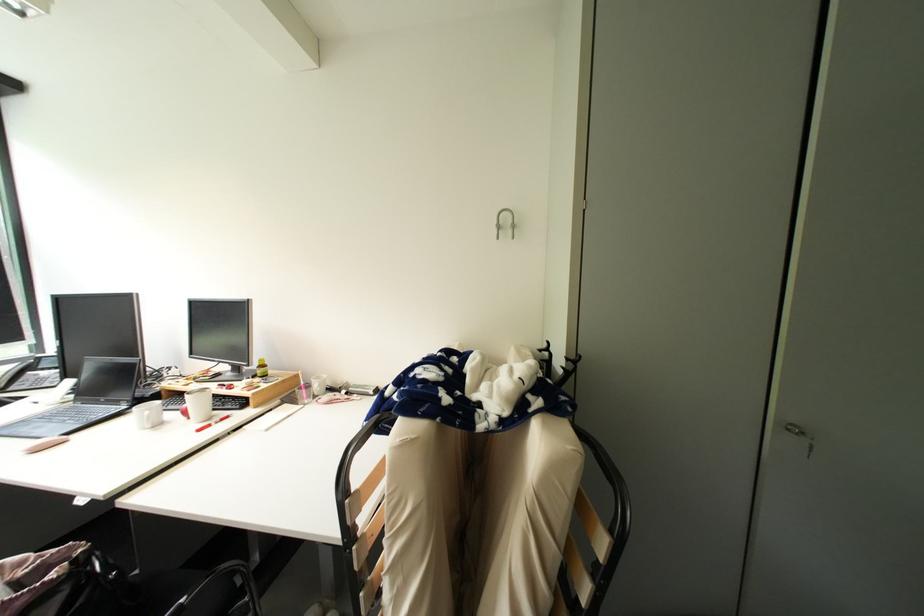
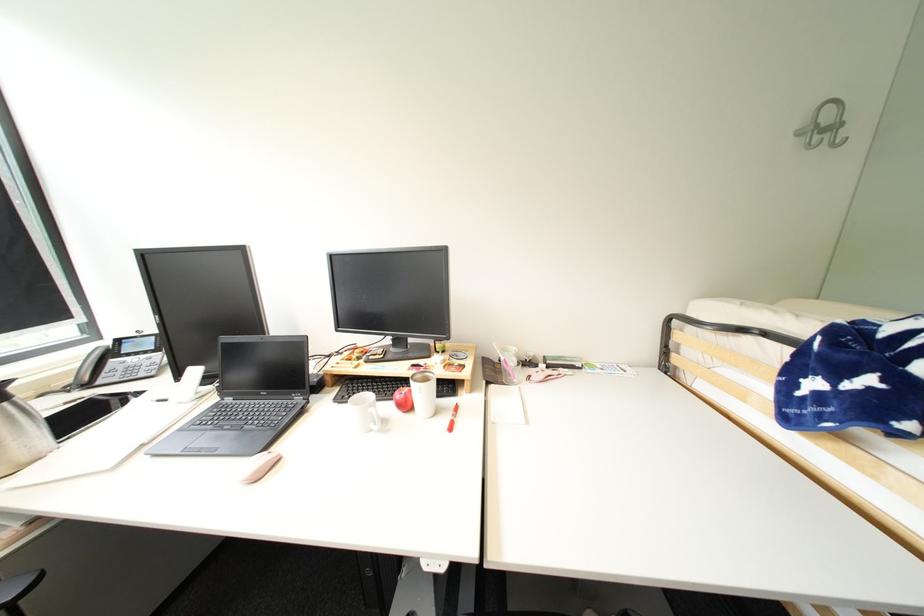
Locate, in the second image, the point that corresponds to (x=191, y=406) in the first image.

(405, 397)